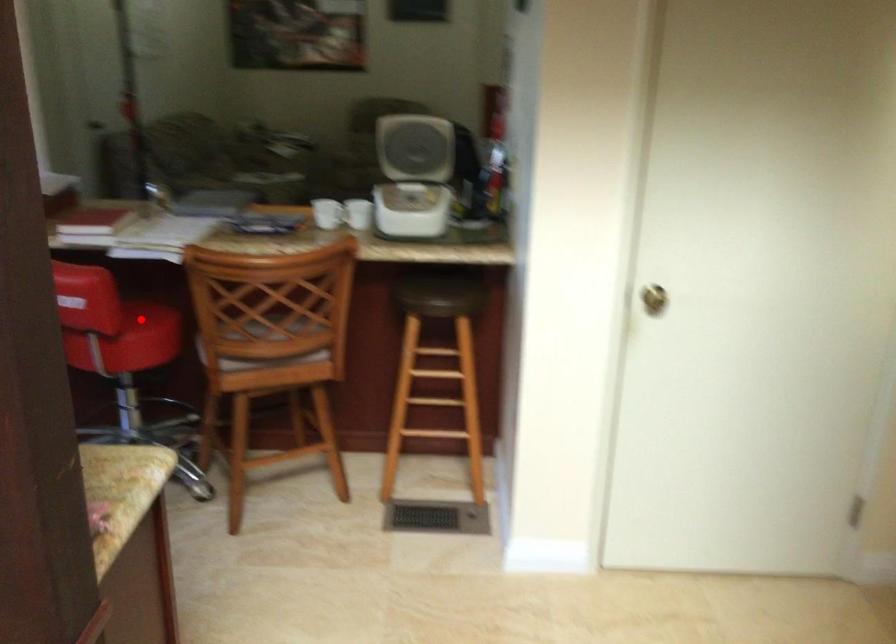
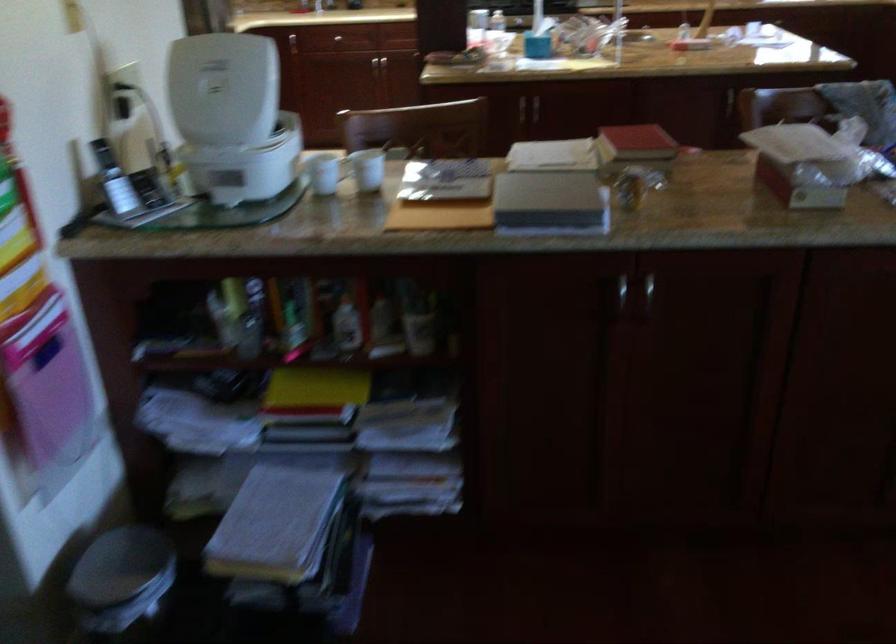
Question: I am providing you with two images of the same scene from different viewpoints. A red point is marked on the first image. At the location where the point appears in image 1, is it still visible in image 2?

Choices:
 (A) Yes
 (B) No

Answer: (B)